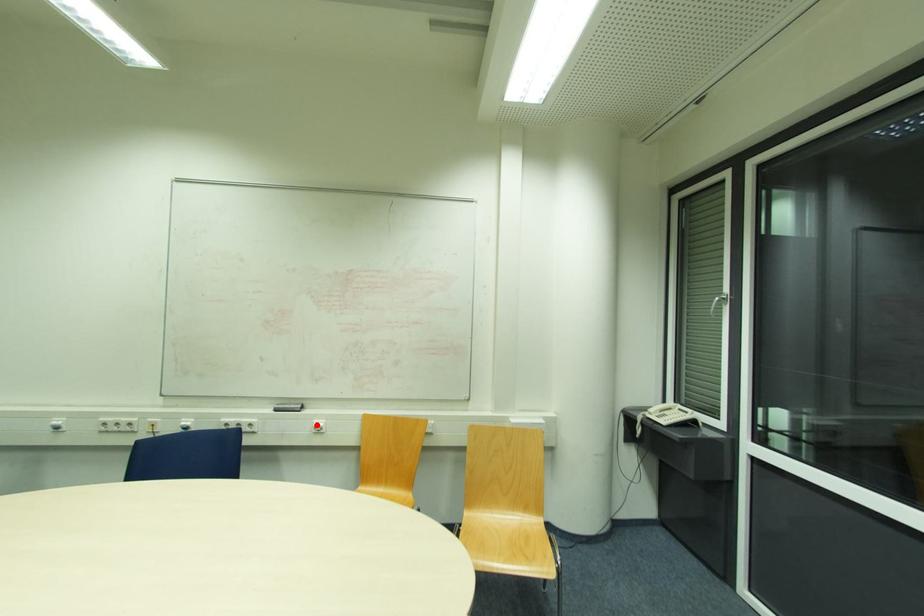
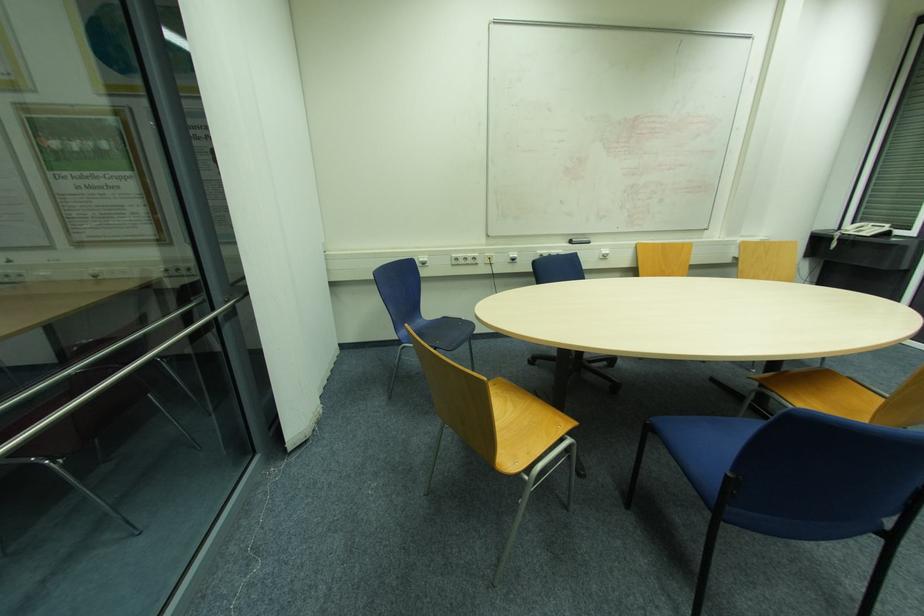
Find the pixel in the second image that matches the highlighted location in the first image.

(604, 253)